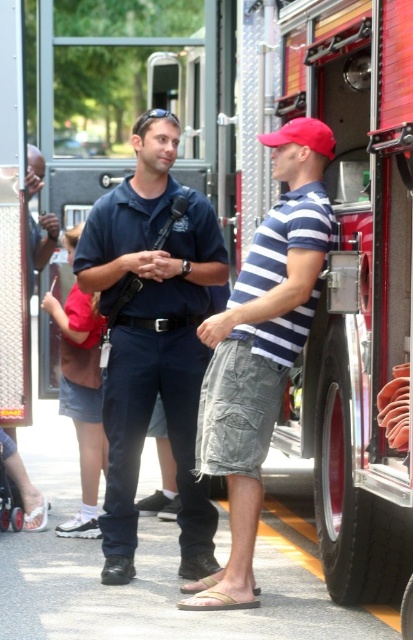
You are standing at the origin point of the coordinate system. The fire truck is in front of you. Where is the dark blue uniform at center relative to your position?

The dark blue uniform at center is located at point (x=152, y=339), which is to the right and slightly forward of your position.

You are standing at the point marked at (140, 452) and want to walk to the fire truck. The fire truck is 10 meters away from you. Can you reach the fire truck within 20 steps if each step covers 0.5 meters?

The distance between you and the fire truck is 10 meters. Each step covers 0.5 meters, so 10 divided by 0.5 equals 20 steps. Therefore, you can reach the fire truck within 20 steps.

You are a photographer trying to capture a clear shot of both the striped cotton shirt at center and the red matte baseball cap at center. Which object should you focus on first to ensure both are in sharp focus?

You should focus on the striped cotton shirt at center first because it is closer to the viewer than the red matte baseball cap at center. By focusing on the closer object, the background object will also be in focus due to the depth of field.